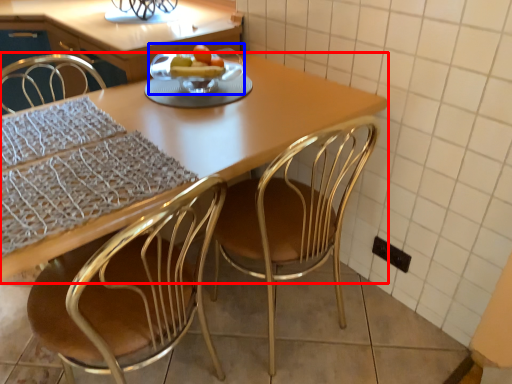
Question: Which object appears closest to the camera in this image, kitchen & dining room table (highlighted by a red box) or fruit dish (highlighted by a blue box)?

Choices:
 (A) kitchen & dining room table
 (B) fruit dish

Answer: (A)